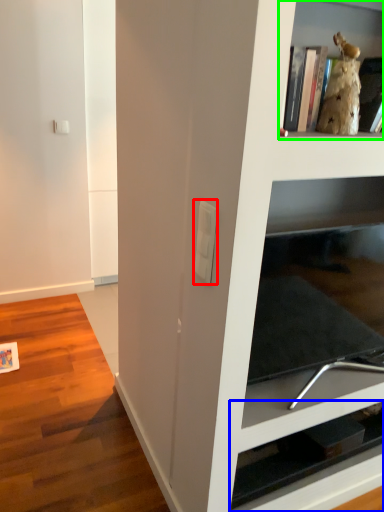
Question: Which is farther away from light switch (highlighted by a red box)? shelf (highlighted by a blue box) or shelf (highlighted by a green box)?

Choices:
 (A) shelf
 (B) shelf

Answer: (A)